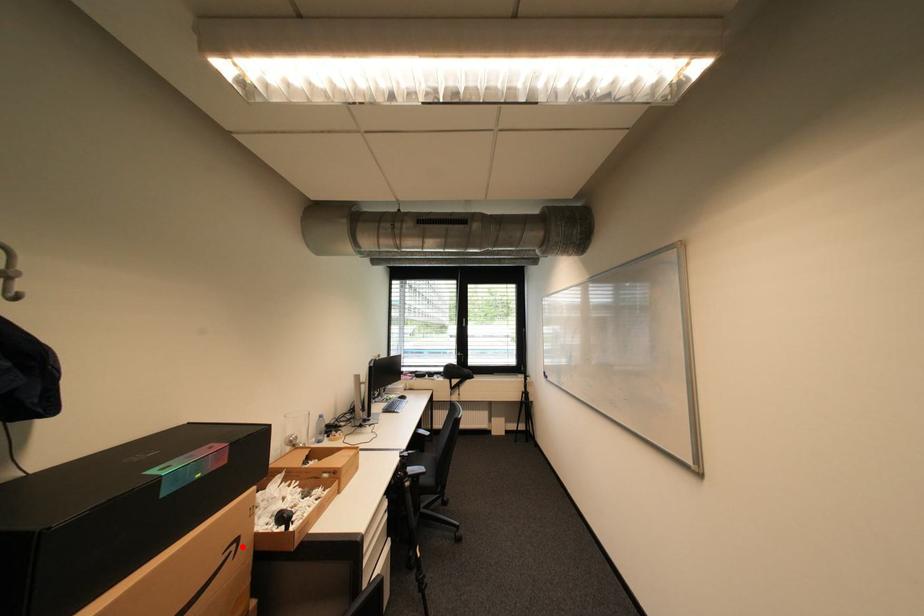
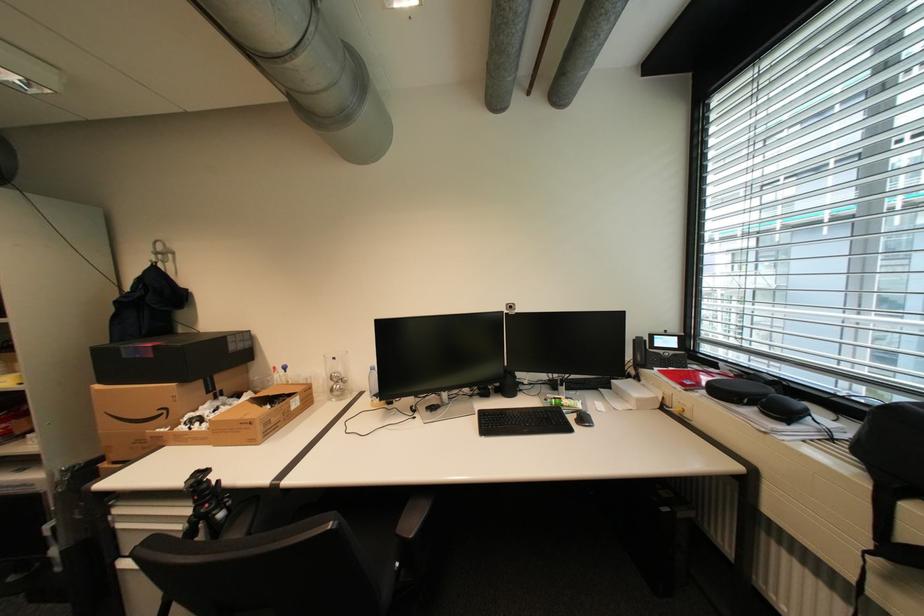
Locate, in the second image, the point that corresponds to the highlighted location in the first image.

(174, 411)